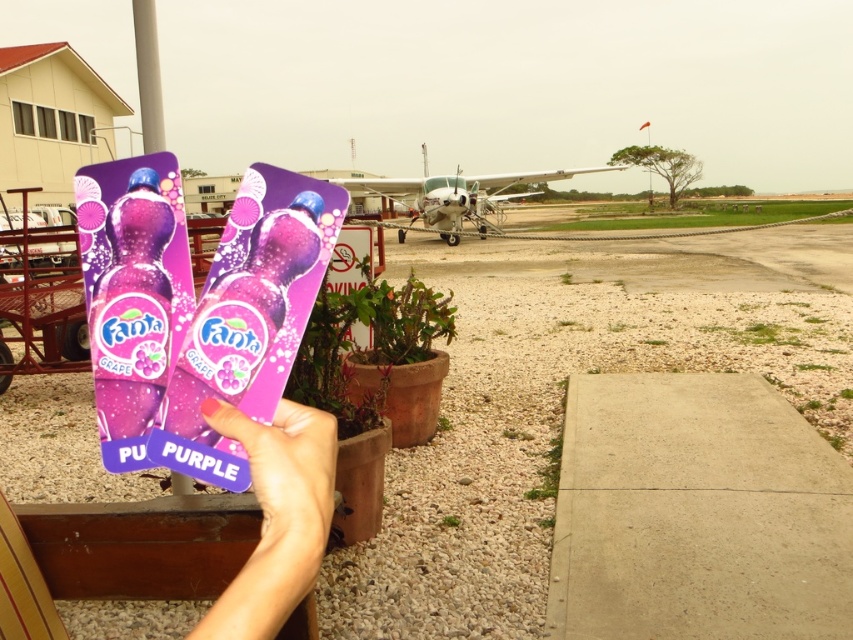
Is purple matte card at lower left to the right of metallic silver airplane at center from the viewer's perspective?

In fact, purple matte card at lower left is to the left of metallic silver airplane at center.

Who is taller, purple matte card at lower left or metallic silver airplane at center?

With more height is metallic silver airplane at center.

Which is in front, point (262, 467) or point (403, 234)?

Positioned in front is point (262, 467).

Find the location of a particular element. The image size is (853, 640). purple matte card at lower left is located at coordinates (276, 516).